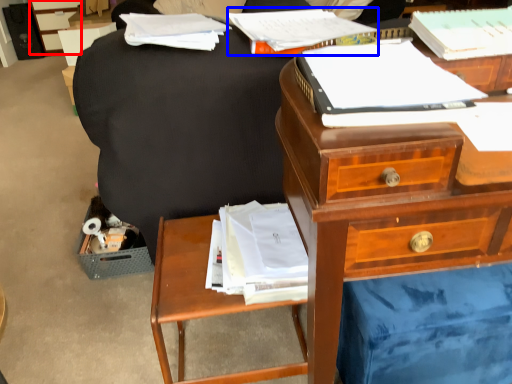
Question: Which of the following is the closest to the observer, file cabinet (highlighted by a red box) or paperback book (highlighted by a blue box)?

Choices:
 (A) file cabinet
 (B) paperback book

Answer: (B)